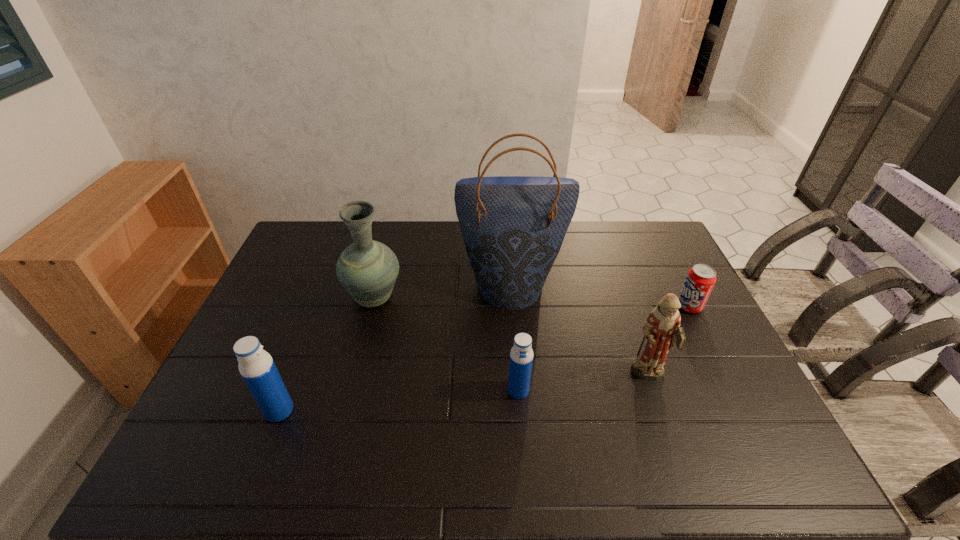
The image size is (960, 540). What are the coordinates of `the left water bottle` in the screenshot? It's located at tap(256, 366).

Locate an element on the screen. the taller water bottle is located at coordinates (256, 366).

Identify the location of the shorter water bottle. Image resolution: width=960 pixels, height=540 pixels. (521, 355).

What are the coordinates of `the second shortest object` in the screenshot? It's located at (521, 355).

You are a GUI agent. You are given a task and a screenshot of the screen. Output one action in this format:
    pyautogui.click(x=<x>, y=<y>)
    Task: Click on the fifth object from right to left
    Image resolution: width=960 pixels, height=540 pixels.
    Given the screenshot: What is the action you would take?
    pyautogui.click(x=367, y=269)

At what (x,y) coordinates should I click in order to perform the action: click on the second tallest object. Please return your answer as a coordinate pair (x, y). Looking at the image, I should click on (367, 269).

Identify the location of shopping bag. The width and height of the screenshot is (960, 540). (513, 227).

At what (x,y) coordinates should I click in order to perform the action: click on the second object from right to left. Please return your answer as a coordinate pair (x, y). Looking at the image, I should click on (661, 329).

Where is `soda can`? soda can is located at coordinates (700, 280).

Locate an element on the screen. The height and width of the screenshot is (540, 960). the shortest object is located at coordinates (700, 280).